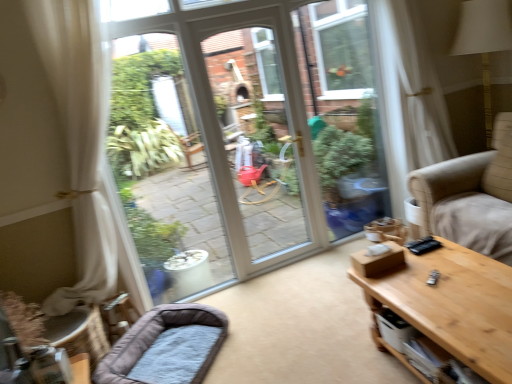
What do you see at coordinates (450, 306) in the screenshot?
I see `wooden table at right` at bounding box center [450, 306].

Identify the location of wooden table at right. The width and height of the screenshot is (512, 384). (450, 306).

What is the approximate height of gray plush dog bed at lower left?

gray plush dog bed at lower left is 9.34 inches tall.

This screenshot has height=384, width=512. What do you see at coordinates (166, 346) in the screenshot? I see `gray plush dog bed at lower left` at bounding box center [166, 346].

The width and height of the screenshot is (512, 384). I want to click on gray plush dog bed at lower left, so click(x=166, y=346).

This screenshot has width=512, height=384. Identify the location of wooden table at right. (450, 306).

Does gray plush dog bed at lower left appear on the right side of wooden table at right?

In fact, gray plush dog bed at lower left is to the left of wooden table at right.

Which is behind, gray plush dog bed at lower left or wooden table at right?

gray plush dog bed at lower left is further from the camera.

Which is closer, (184,381) or (474,284)?

Clearly, point (184,381) is more distant from the camera than point (474,284).

From the image's perspective, does gray plush dog bed at lower left appear higher than wooden table at right?

Actually, gray plush dog bed at lower left appears below wooden table at right in the image.

From a real-world perspective, is gray plush dog bed at lower left physically located above or below wooden table at right?

gray plush dog bed at lower left is below wooden table at right.

Which of these two, gray plush dog bed at lower left or wooden table at right, is thinner?

gray plush dog bed at lower left is thinner.

Who is shorter, gray plush dog bed at lower left or wooden table at right?

Standing shorter between the two is gray plush dog bed at lower left.

Between gray plush dog bed at lower left and wooden table at right, which one has larger size?

Bigger between the two is wooden table at right.

Is wooden table at right surrounded by gray plush dog bed at lower left?

No.

Can you see gray plush dog bed at lower left touching wooden table at right?

gray plush dog bed at lower left and wooden table at right are not in contact.

Is gray plush dog bed at lower left looking in the opposite direction of wooden table at right?

No, wooden table at right is not at the back of gray plush dog bed at lower left.

Looking at this image, how many degrees apart are the facing directions of gray plush dog bed at lower left and wooden table at right?

The facing directions of gray plush dog bed at lower left and wooden table at right are 143 degrees apart.

This screenshot has height=384, width=512. I want to click on table on the right side of gray plush dog bed at lower left, so click(450, 306).

Visually, is wooden table at right positioned to the left or to the right of gray plush dog bed at lower left?

Based on their positions, wooden table at right is located to the right of gray plush dog bed at lower left.

Is wooden table at right closer to the viewer compared to gray plush dog bed at lower left?

Yes, it is in front of gray plush dog bed at lower left.

Is point (506, 317) closer or farther from the camera than point (140, 328)?

Point (506, 317) appears to be closer to the viewer than point (140, 328).

From the image's perspective, which is above, wooden table at right or gray plush dog bed at lower left?

From the image's view, wooden table at right is above.

From a real-world perspective, which object rests below the other?

From a 3D spatial view, gray plush dog bed at lower left is below.

Looking at this image, in terms of width, does wooden table at right look wider or thinner when compared to gray plush dog bed at lower left?

wooden table at right is wider than gray plush dog bed at lower left.

Considering the sizes of objects wooden table at right and gray plush dog bed at lower left in the image provided, who is taller, wooden table at right or gray plush dog bed at lower left?

wooden table at right.

Between wooden table at right and gray plush dog bed at lower left, which one has larger size?

wooden table at right is bigger.

Is gray plush dog bed at lower left inside wooden table at right?

No, gray plush dog bed at lower left is not a part of wooden table at right.

Is the surface of wooden table at right in direct contact with gray plush dog bed at lower left?

No, wooden table at right is not in contact with gray plush dog bed at lower left.

Could you tell me if wooden table at right is facing gray plush dog bed at lower left?

Yes.

How many degrees apart are the facing directions of wooden table at right and gray plush dog bed at lower left?

The angle between the facing direction of wooden table at right and the facing direction of gray plush dog bed at lower left is 143 degrees.

Locate an element on the screen. This screenshot has width=512, height=384. table above the gray plush dog bed at lower left (from a real-world perspective) is located at coordinates (450, 306).

The height and width of the screenshot is (384, 512). Find the location of `table above the gray plush dog bed at lower left (from the image's perspective)`. table above the gray plush dog bed at lower left (from the image's perspective) is located at coordinates (450, 306).

The width and height of the screenshot is (512, 384). In the image, there is a wooden table at right. In order to click on dog bed below it (from a real-world perspective) in this screenshot , I will do click(x=166, y=346).